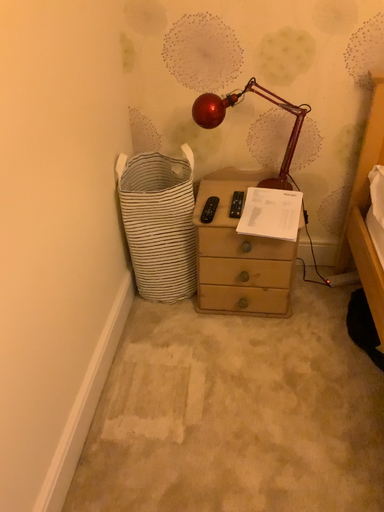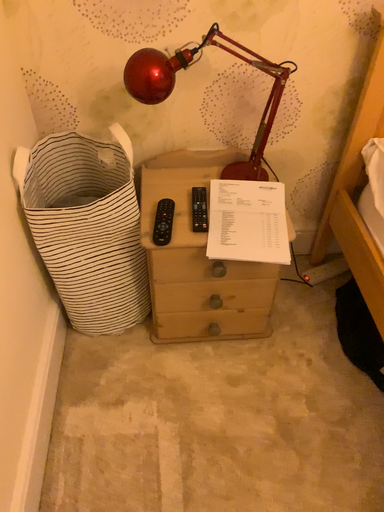
Question: How did the camera likely rotate when shooting the video?

Choices:
 (A) rotated downward
 (B) rotated upward

Answer: (A)